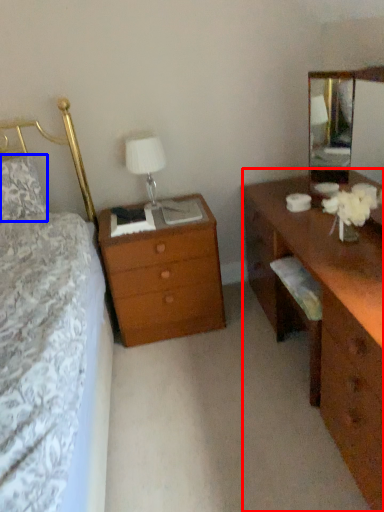
Question: Among these objects, which one is farthest to the camera, desk (highlighted by a red box) or pillow (highlighted by a blue box)?

Choices:
 (A) desk
 (B) pillow

Answer: (B)